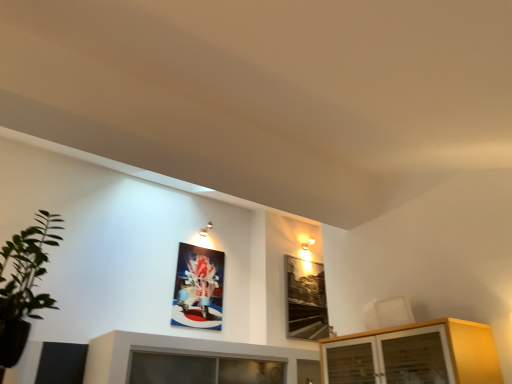
This screenshot has width=512, height=384. I want to click on black glass picture frame at upper right, positioned as the second picture frame in left-to-right order, so click(x=305, y=299).

Where is `green leafy plant at left`? The image size is (512, 384). green leafy plant at left is located at coordinates (24, 284).

This screenshot has height=384, width=512. Describe the element at coordinates (440, 352) in the screenshot. I see `light wood cabinet at lower right` at that location.

How much space does metallic glossy picture frame at upper center, the first picture frame from the left, occupy vertically?

It is 92.71 centimeters.

Identify the location of black glass picture frame at upper right, which appears as the first picture frame when viewed from the right. (305, 299).

Does point (6, 298) come behind point (328, 378)?

No, (6, 298) is closer to viewer.

From a real-world perspective, which is physically above, green leafy plant at left or light wood cabinet at lower right?

In real-world perspective, green leafy plant at left is above.

From the picture: Could you tell me if green leafy plant at left is turned towards light wood cabinet at lower right?

No, green leafy plant at left is not aimed at light wood cabinet at lower right.

Is metallic glossy picture frame at upper center, placed as the 2th picture frame when sorted from right to left, to the right of black glass picture frame at upper right, positioned as the second picture frame in left-to-right order, from the viewer's perspective?

No, metallic glossy picture frame at upper center, placed as the 2th picture frame when sorted from right to left, is not to the right of black glass picture frame at upper right, positioned as the second picture frame in left-to-right order.

How many degrees apart are the facing directions of metallic glossy picture frame at upper center, the first picture frame from the left, and black glass picture frame at upper right, positioned as the second picture frame in left-to-right order?

They differ by 0.0142 degrees in their facing directions.

Is metallic glossy picture frame at upper center, the first picture frame from the left, thinner than black glass picture frame at upper right, positioned as the second picture frame in left-to-right order?

Yes.

Does metallic glossy picture frame at upper center, the first picture frame from the left, have a smaller size compared to light wood cabinet at lower right?

Indeed, metallic glossy picture frame at upper center, the first picture frame from the left, has a smaller size compared to light wood cabinet at lower right.

From the picture: Is metallic glossy picture frame at upper center, the first picture frame from the left, not near light wood cabinet at lower right?

Yes, metallic glossy picture frame at upper center, the first picture frame from the left, and light wood cabinet at lower right are quite far apart.

From the image's perspective, who appears lower, metallic glossy picture frame at upper center, placed as the 2th picture frame when sorted from right to left, or light wood cabinet at lower right?

metallic glossy picture frame at upper center, placed as the 2th picture frame when sorted from right to left, from the image's perspective.

Can you confirm if metallic glossy picture frame at upper center, the first picture frame from the left, is shorter than light wood cabinet at lower right?

Incorrect, the height of metallic glossy picture frame at upper center, the first picture frame from the left, does not fall short of that of light wood cabinet at lower right.

From the image's perspective, which object appears higher, light wood cabinet at lower right or green leafy plant at left?

From the image's view, green leafy plant at left is above.

Who is bigger, light wood cabinet at lower right or green leafy plant at left?

Bigger between the two is light wood cabinet at lower right.

Does point (446, 357) lie in front of point (56, 245)?

Yes, it is.

Between metallic glossy picture frame at upper center, the first picture frame from the left, and green leafy plant at left, which one is positioned behind?

metallic glossy picture frame at upper center, the first picture frame from the left, is more distant.

Is metallic glossy picture frame at upper center, the first picture frame from the left, wider or thinner than green leafy plant at left?

Considering their sizes, metallic glossy picture frame at upper center, the first picture frame from the left, looks slimmer than green leafy plant at left.

Can you tell me how much metallic glossy picture frame at upper center, the first picture frame from the left, and green leafy plant at left differ in facing direction?

The facing directions of metallic glossy picture frame at upper center, the first picture frame from the left, and green leafy plant at left are 3.06 degrees apart.

Is metallic glossy picture frame at upper center, placed as the 2th picture frame when sorted from right to left, at the left side of green leafy plant at left?

No.

Is black glass picture frame at upper right, positioned as the second picture frame in left-to-right order, at the left side of light wood cabinet at lower right?

Correct, you'll find black glass picture frame at upper right, positioned as the second picture frame in left-to-right order, to the left of light wood cabinet at lower right.

Is the position of black glass picture frame at upper right, positioned as the second picture frame in left-to-right order, less distant than that of light wood cabinet at lower right?

That is False.

Between point (321, 267) and point (464, 351), which one is positioned in front?

The point (464, 351) is closer.

From the picture: How many degrees apart are the facing directions of light wood cabinet at lower right and black glass picture frame at upper right, which appears as the first picture frame when viewed from the right?

The angle between the facing direction of light wood cabinet at lower right and the facing direction of black glass picture frame at upper right, which appears as the first picture frame when viewed from the right, is 90.9 degrees.

From a real-world perspective, is light wood cabinet at lower right over black glass picture frame at upper right, positioned as the second picture frame in left-to-right order?

Actually, light wood cabinet at lower right is physically below black glass picture frame at upper right, positioned as the second picture frame in left-to-right order, in the real world.

Does light wood cabinet at lower right appear on the right side of black glass picture frame at upper right, positioned as the second picture frame in left-to-right order?

Yes, light wood cabinet at lower right is to the right of black glass picture frame at upper right, positioned as the second picture frame in left-to-right order.

Is light wood cabinet at lower right positioned far away from black glass picture frame at upper right, positioned as the second picture frame in left-to-right order?

Yes.

This screenshot has width=512, height=384. I want to click on cabinetry located on the right of green leafy plant at left, so click(x=440, y=352).

What are the coordinates of `picture frame located below the metallic glossy picture frame at upper center, placed as the 2th picture frame when sorted from right to left (from the image's perspective)` in the screenshot? It's located at (305, 299).

From the image, which object appears to be nearer to light wood cabinet at lower right, black glass picture frame at upper right, positioned as the second picture frame in left-to-right order, or metallic glossy picture frame at upper center, placed as the 2th picture frame when sorted from right to left?

metallic glossy picture frame at upper center, placed as the 2th picture frame when sorted from right to left.

Looking at the image, which one is located closer to light wood cabinet at lower right, metallic glossy picture frame at upper center, the first picture frame from the left, or green leafy plant at left?

metallic glossy picture frame at upper center, the first picture frame from the left, is positioned closer to the anchor light wood cabinet at lower right.

Based on their spatial positions, is green leafy plant at left or light wood cabinet at lower right further from metallic glossy picture frame at upper center, the first picture frame from the left?

The object further to metallic glossy picture frame at upper center, the first picture frame from the left, is light wood cabinet at lower right.

From the image, which object appears to be farther from light wood cabinet at lower right, metallic glossy picture frame at upper center, the first picture frame from the left, or black glass picture frame at upper right, positioned as the second picture frame in left-to-right order?

black glass picture frame at upper right, positioned as the second picture frame in left-to-right order, lies further to light wood cabinet at lower right than the other object.

When comparing their distances from light wood cabinet at lower right, does green leafy plant at left or black glass picture frame at upper right, which appears as the first picture frame when viewed from the right, seem closer?

green leafy plant at left lies closer to light wood cabinet at lower right than the other object.

When comparing their distances from green leafy plant at left, does light wood cabinet at lower right or black glass picture frame at upper right, positioned as the second picture frame in left-to-right order, seem further?

black glass picture frame at upper right, positioned as the second picture frame in left-to-right order, is positioned further to the anchor green leafy plant at left.

Estimate the real-world distances between objects in this image. Which object is closer to green leafy plant at left, metallic glossy picture frame at upper center, placed as the 2th picture frame when sorted from right to left, or black glass picture frame at upper right, positioned as the second picture frame in left-to-right order?

Based on the image, metallic glossy picture frame at upper center, placed as the 2th picture frame when sorted from right to left, appears to be nearer to green leafy plant at left.

Estimate the real-world distances between objects in this image. Which object is further from black glass picture frame at upper right, which appears as the first picture frame when viewed from the right, light wood cabinet at lower right or metallic glossy picture frame at upper center, placed as the 2th picture frame when sorted from right to left?

light wood cabinet at lower right is positioned further to the anchor black glass picture frame at upper right, which appears as the first picture frame when viewed from the right.

The width and height of the screenshot is (512, 384). Find the location of `cabinetry located between green leafy plant at left and black glass picture frame at upper right, which appears as the first picture frame when viewed from the right, in the depth direction`. cabinetry located between green leafy plant at left and black glass picture frame at upper right, which appears as the first picture frame when viewed from the right, in the depth direction is located at coordinates (440, 352).

Find the location of a particular element. The image size is (512, 384). picture frame between light wood cabinet at lower right and black glass picture frame at upper right, which appears as the first picture frame when viewed from the right, from front to back is located at coordinates (198, 288).

This screenshot has width=512, height=384. Find the location of `cabinetry between green leafy plant at left and metallic glossy picture frame at upper center, placed as the 2th picture frame when sorted from right to left, along the z-axis`. cabinetry between green leafy plant at left and metallic glossy picture frame at upper center, placed as the 2th picture frame when sorted from right to left, along the z-axis is located at coordinates (440, 352).

Find the location of `picture frame between green leafy plant at left and black glass picture frame at upper right, positioned as the second picture frame in left-to-right order, in the front-back direction`. picture frame between green leafy plant at left and black glass picture frame at upper right, positioned as the second picture frame in left-to-right order, in the front-back direction is located at coordinates pyautogui.click(x=198, y=288).